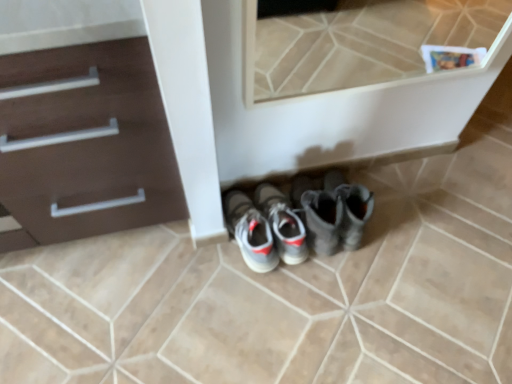
Locate an element on the screen. gray fabric sneakers at center is located at coordinates (301, 219).

The height and width of the screenshot is (384, 512). What do you see at coordinates (301, 219) in the screenshot?
I see `gray fabric sneakers at center` at bounding box center [301, 219].

In order to face gray fabric sneakers at center, should I rotate leftwards or rightwards?

Rotate your view right by about 1.367°.

Where is `gray fabric sneakers at center`? Image resolution: width=512 pixels, height=384 pixels. gray fabric sneakers at center is located at coordinates (301, 219).